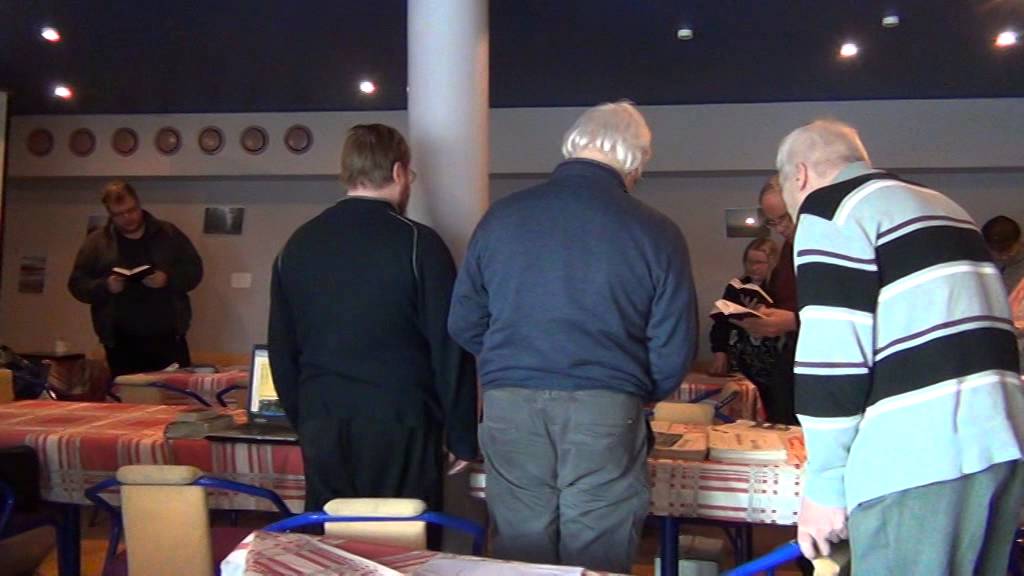
Locate an element on the screen. The height and width of the screenshot is (576, 1024). laptop is located at coordinates (245, 424), (257, 380).